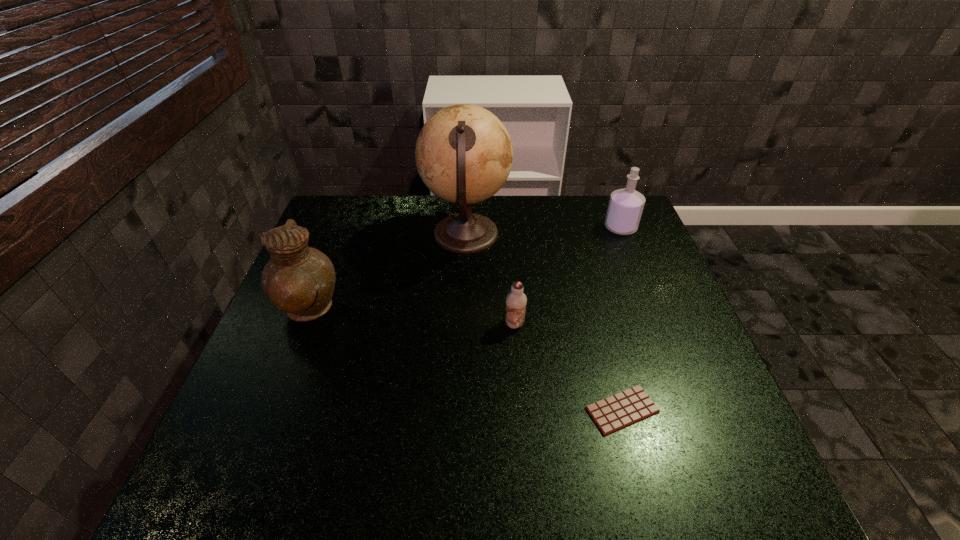
This screenshot has height=540, width=960. In the image, there is a desktop. Identify the location of vacant space at the near edge. (455, 497).

This screenshot has width=960, height=540. Find the location of `vacant space at the left edge of the desktop`. vacant space at the left edge of the desktop is located at coordinates (255, 368).

This screenshot has width=960, height=540. Identify the location of free space at the right edge of the desktop. (653, 243).

The width and height of the screenshot is (960, 540). Identify the location of free space at the far left corner of the desktop. (349, 218).

Where is `vacant space at the far right corner`? The height and width of the screenshot is (540, 960). vacant space at the far right corner is located at coordinates (586, 205).

This screenshot has height=540, width=960. I want to click on empty location between the pitcher and the rightmost object, so click(x=464, y=269).

In order to click on vacant area between the fourth object from left to right and the second shortest object in this screenshot , I will do `click(568, 367)`.

Locate an element on the screen. Image resolution: width=960 pixels, height=540 pixels. free space between the globe and the candy bar is located at coordinates (544, 322).

Identify the location of free space between the second tallest object and the tallest object. The width and height of the screenshot is (960, 540). pos(387,273).

What are the coordinates of `free space between the third tallest object and the candy bar` in the screenshot? It's located at (621, 319).